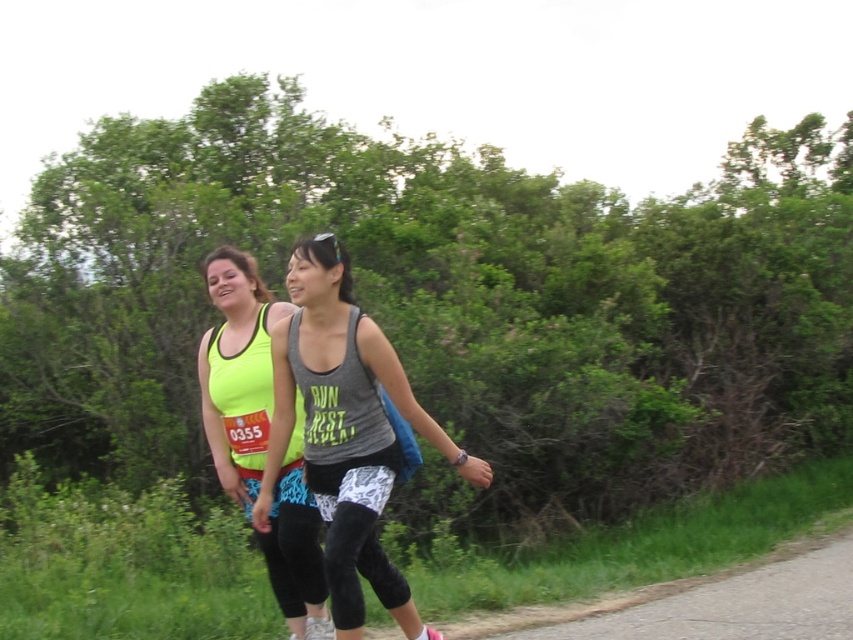
Is gray matte tank top at center to the right of neon yellow tank top at center from the viewer's perspective?

Yes, gray matte tank top at center is to the right of neon yellow tank top at center.

Between point (387, 381) and point (231, 330), which one is positioned in front?

Point (387, 381)

Where is `gray matte tank top at center`? gray matte tank top at center is located at coordinates (346, 432).

Does neon yellow tank top at center have a greater height compared to gravel road at lower right?

Yes, neon yellow tank top at center is taller than gravel road at lower right.

Based on the photo, between neon yellow tank top at center and gravel road at lower right, which one is positioned lower?

gravel road at lower right is below.

The width and height of the screenshot is (853, 640). I want to click on neon yellow tank top at center, so click(x=236, y=371).

Does gray matte tank top at center have a greater height compared to gravel road at lower right?

Yes.

Image resolution: width=853 pixels, height=640 pixels. What do you see at coordinates (346, 432) in the screenshot? I see `gray matte tank top at center` at bounding box center [346, 432].

Find the location of a particular element. The image size is (853, 640). gray matte tank top at center is located at coordinates (346, 432).